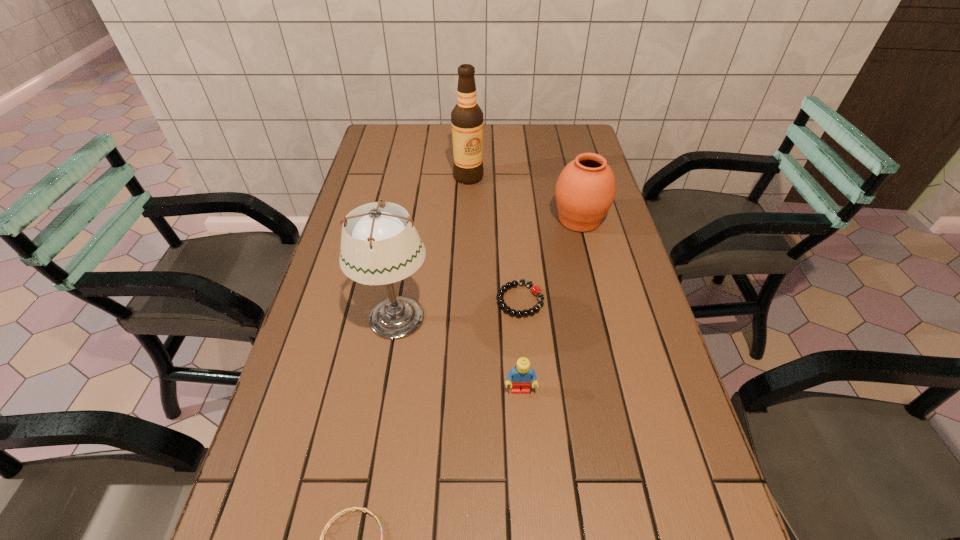
Locate an element on the screen. the fourth object from right to left is located at coordinates (466, 117).

You are a GUI agent. You are given a task and a screenshot of the screen. Output one action in this format:
    pyautogui.click(x=<x>, y=<y>)
    Task: Click on the alcohol
    The width and height of the screenshot is (960, 540).
    Given the screenshot: What is the action you would take?
    pyautogui.click(x=466, y=117)

In order to click on lampshade in this screenshot , I will do `click(380, 245)`.

The image size is (960, 540). I want to click on the fifth nearest object, so click(x=585, y=190).

At what (x,y) coordinates should I click in order to perform the action: click on urn. Please return your answer as a coordinate pair (x, y). This screenshot has height=540, width=960. Looking at the image, I should click on (585, 190).

At what (x,y) coordinates should I click in order to perform the action: click on the fifth farthest object. Please return your answer as a coordinate pair (x, y). The height and width of the screenshot is (540, 960). Looking at the image, I should click on (522, 375).

I want to click on the third shortest object, so click(522, 375).

You are a GUI agent. You are given a task and a screenshot of the screen. Output one action in this format:
    pyautogui.click(x=<x>, y=<y>)
    Task: Click on the farther bracelet
    
    Given the screenshot: What is the action you would take?
    pyautogui.click(x=535, y=289)

Where is `the right bracelet`? Image resolution: width=960 pixels, height=540 pixels. the right bracelet is located at coordinates (535, 289).

Locate an element on the screen. vacant space located 0.300m on the label of the farthest object is located at coordinates (467, 247).